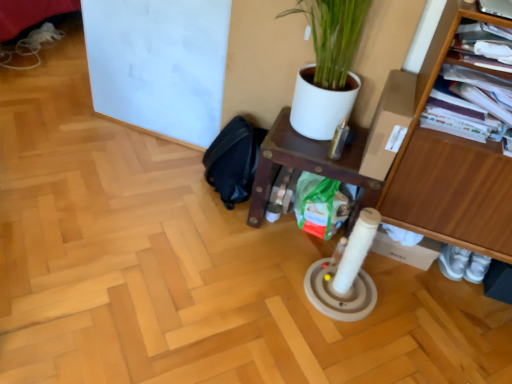
At what (x,y) coordinates should I click in order to perform the action: click on free space in front of wooden shelf at center. Please return your answer as a coordinate pair (x, y). Looking at the image, I should click on (286, 287).